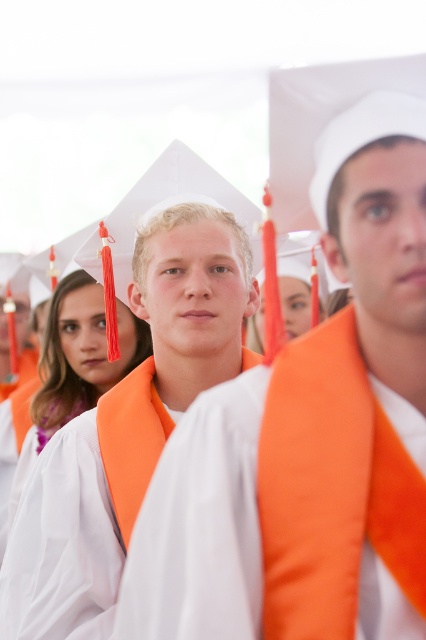
Question: Which point is closer to the camera?

Choices:
 (A) (37, 524)
 (B) (212, 508)

Answer: (B)

Question: Where is matte orange graduation gown at center located in relation to white matte graduation gown at center in the image?

Choices:
 (A) right
 (B) left

Answer: (A)

Question: Is matte orange graduation gown at center to the right of white matte graduation gown at center from the viewer's perspective?

Choices:
 (A) no
 (B) yes

Answer: (B)

Question: Can you confirm if matte orange graduation gown at center is wider than white matte graduation gown at center?

Choices:
 (A) no
 (B) yes

Answer: (A)

Question: Which point appears closest to the camera in this image?

Choices:
 (A) (340, 580)
 (B) (77, 516)

Answer: (A)

Question: Which object appears closest to the camera in this image?

Choices:
 (A) matte orange graduation gown at center
 (B) white matte graduation gown at center

Answer: (A)